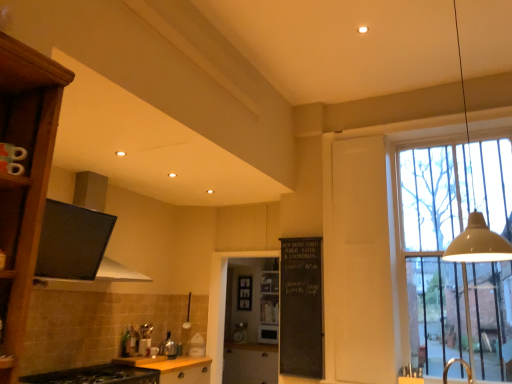
Question: Is beige matte pendant lamp at upper right touching black chalkboard at center?

Choices:
 (A) no
 (B) yes

Answer: (A)

Question: Considering the relative sizes of beige matte pendant lamp at upper right and black chalkboard at center in the image provided, is beige matte pendant lamp at upper right bigger than black chalkboard at center?

Choices:
 (A) no
 (B) yes

Answer: (B)

Question: Can you confirm if beige matte pendant lamp at upper right is taller than black chalkboard at center?

Choices:
 (A) no
 (B) yes

Answer: (B)

Question: Does beige matte pendant lamp at upper right appear on the right side of black chalkboard at center?

Choices:
 (A) no
 (B) yes

Answer: (B)

Question: Does beige matte pendant lamp at upper right appear on the left side of black chalkboard at center?

Choices:
 (A) no
 (B) yes

Answer: (A)

Question: Visually, is clear glass window at right positioned to the left or to the right of black matte cabinet at lower left, the 1th cabinetry from the front?

Choices:
 (A) left
 (B) right

Answer: (B)

Question: Is clear glass window at right situated inside black matte cabinet at lower left, which is counted as the third cabinetry, starting from the bottom, or outside?

Choices:
 (A) outside
 (B) inside

Answer: (A)

Question: Relative to black matte cabinet at lower left, the first cabinetry viewed from the top, is clear glass window at right in front or behind?

Choices:
 (A) front
 (B) behind

Answer: (B)

Question: From their relative heights in the image, would you say clear glass window at right is taller or shorter than black matte cabinet at lower left, acting as the third cabinetry starting from the back?

Choices:
 (A) short
 (B) tall

Answer: (B)

Question: From the image's perspective, is matte black microwave at center, the 2th appliance positioned from the top, positioned above or below transparent glass screen door at center?

Choices:
 (A) below
 (B) above

Answer: (A)

Question: In the image, is matte black microwave at center, which appears as the first appliance when viewed from the right, positioned in front of or behind transparent glass screen door at center?

Choices:
 (A) front
 (B) behind

Answer: (B)

Question: Considering the positions of matte black microwave at center, the 1th appliance positioned from the back, and transparent glass screen door at center in the image, is matte black microwave at center, the 1th appliance positioned from the back, wider or thinner than transparent glass screen door at center?

Choices:
 (A) thin
 (B) wide

Answer: (B)

Question: From a real-world perspective, is matte black microwave at center, the second appliance from the left, positioned above or below transparent glass screen door at center?

Choices:
 (A) below
 (B) above

Answer: (A)

Question: From their relative heights in the image, would you say matte wood cabinet at center, acting as the first cabinetry starting from the bottom, is taller or shorter than wooden at center?

Choices:
 (A) short
 (B) tall

Answer: (B)

Question: Considering the positions of matte wood cabinet at center, marked as the 1th cabinetry in a back-to-front arrangement, and wooden at center in the image, is matte wood cabinet at center, marked as the 1th cabinetry in a back-to-front arrangement, bigger or smaller than wooden at center?

Choices:
 (A) big
 (B) small

Answer: (A)